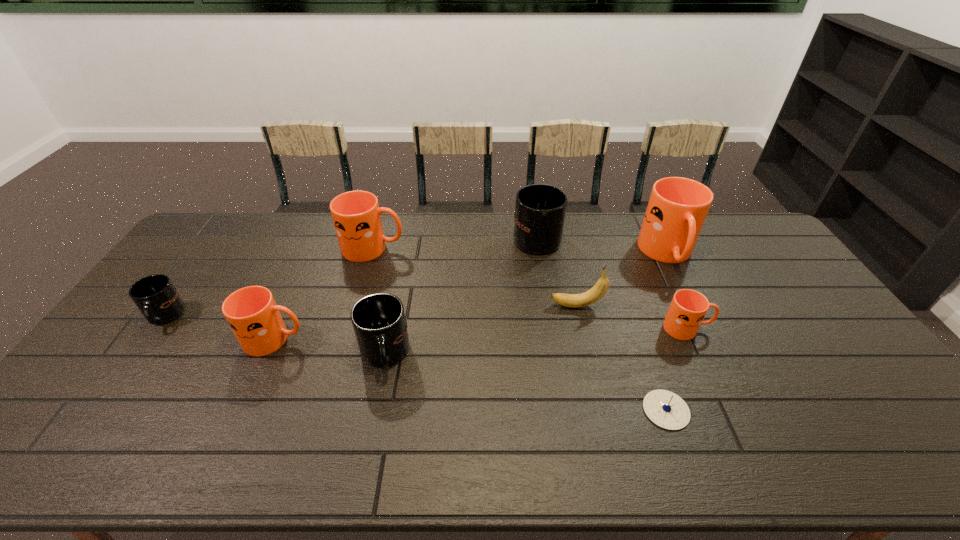
Locate an element on the screen. object that is the third closest to the third smallest orange mug is located at coordinates (540, 209).

Locate which object ranks fifth in proximity to the leftmost orange mug. Please provide its 2D coordinates. Your answer should be formatted as a tuple, i.e. [(x, y)], where the tuple contains the x and y coordinates of a point satisfying the conditions above.

[(591, 296)]

What are the coordinates of `the third closest mug to the sixth mug from right to left` in the screenshot? It's located at (356, 215).

Where is `mug that is the closest to the third mug from right to left`? The image size is (960, 540). mug that is the closest to the third mug from right to left is located at coordinates (677, 208).

Locate which orange mug ranks second in proximity to the sixth mug from right to left. Please provide its 2D coordinates. Your answer should be formatted as a tuple, i.e. [(x, y)], where the tuple contains the x and y coordinates of a point satisfying the conditions above.

[(685, 315)]

This screenshot has height=540, width=960. What are the coordinates of `orange mug that can be found as the second closest to the leftmost object` in the screenshot? It's located at (356, 215).

Find the location of a particular element. Image resolution: width=960 pixels, height=540 pixels. the closest black mug to the shortest object is located at coordinates (540, 209).

Where is `black mug identified as the closest to the leftmost mug`? The height and width of the screenshot is (540, 960). black mug identified as the closest to the leftmost mug is located at coordinates (379, 322).

Locate an element on the screen. Image resolution: width=960 pixels, height=540 pixels. free spot that satisfies the following two spatial constraints: 1. on the handle side of the tallest mug; 2. on the handle side of the leftmost orange mug is located at coordinates (710, 340).

At what (x,y) coordinates should I click in order to perform the action: click on free space that satisfies the following two spatial constraints: 1. with the handle on the side of the leftmost mug; 2. on the left side of the seventh object from left to right. Please return your answer as a coordinate pair (x, y). Looking at the image, I should click on (98, 410).